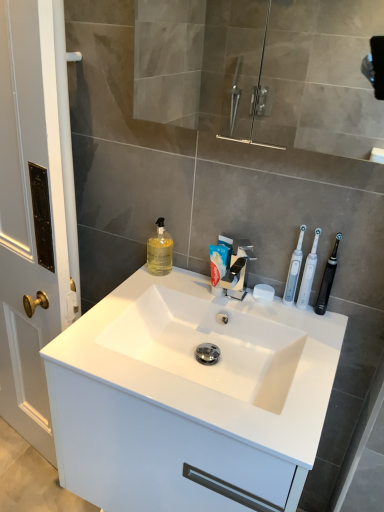
You are a GUI agent. You are given a task and a screenshot of the screen. Output one action in this format:
    pyautogui.click(x=<x>, y=<y>)
    Task: Click on the white matte soap at center
    This screenshot has width=384, height=512.
    Given the screenshot: What is the action you would take?
    pyautogui.click(x=263, y=293)

The height and width of the screenshot is (512, 384). Identify the location of white matte toothpaste at center. (219, 263).

How much space does white plastic toothbrushes at right, which is the 1th toothbrush in left-to-right order, occupy vertically?

white plastic toothbrushes at right, which is the 1th toothbrush in left-to-right order, is 9.53 inches tall.

What do you see at coordinates (327, 279) in the screenshot? I see `black plastic toothbrush at right, which is the first toothbrush in right-to-left order` at bounding box center [327, 279].

Locate an element on the screen. white matte soap at center is located at coordinates (263, 293).

Could you tell me if black plastic toothbrush at right, which is the third toothbrush from left to right, is turned towards white matte soap at center?

No, black plastic toothbrush at right, which is the third toothbrush from left to right, is not facing towards white matte soap at center.

From the picture: Can you confirm if black plastic toothbrush at right, which is the first toothbrush in right-to-left order, is shorter than white matte soap at center?

No, black plastic toothbrush at right, which is the first toothbrush in right-to-left order, is not shorter than white matte soap at center.

From the image's perspective, is black plastic toothbrush at right, which is the third toothbrush from left to right, located above white matte soap at center?

Yes, from the image's perspective, black plastic toothbrush at right, which is the third toothbrush from left to right, is over white matte soap at center.

Is point (322, 303) closer to viewer compared to point (264, 300)?

Yes, point (322, 303) is in front of point (264, 300).

Is black plastic toothbrush at right, which is the first toothbrush in right-to-left order, at the back of white matte soap at center?

That's not correct — white matte soap at center is not looking away from black plastic toothbrush at right, which is the first toothbrush in right-to-left order.

Image resolution: width=384 pixels, height=512 pixels. What are the coordinates of `the 3rd toothbrush counting from the right side of the white matte soap at center` in the screenshot? It's located at 327,279.

From their relative heights in the image, would you say white matte soap at center is taller or shorter than black plastic toothbrush at right, which is the first toothbrush in right-to-left order?

Considering their sizes, white matte soap at center has less height than black plastic toothbrush at right, which is the first toothbrush in right-to-left order.

Does white matte soap at center appear on the left side of black plastic toothbrush at right, which is the third toothbrush from left to right?

Indeed, white matte soap at center is positioned on the left side of black plastic toothbrush at right, which is the third toothbrush from left to right.

From a real-world perspective, is transparent glass mirror at upper center positioned over polished chrome faucet at center based on gravity?

Yes.

From the image's perspective, is transparent glass mirror at upper center positioned above or below polished chrome faucet at center?

From the image's perspective, transparent glass mirror at upper center appears above polished chrome faucet at center.

Locate an element on the screen. This screenshot has width=384, height=512. mirror located above the polished chrome faucet at center (from a real-world perspective) is located at coordinates (321, 77).

Which object is more forward, transparent glass mirror at upper center or polished chrome faucet at center?

transparent glass mirror at upper center.

From the image's perspective, relative to black plastic toothbrush at right, which is the first toothbrush in right-to-left order, is white matte toothpaste at center above or below?

Based on their image positions, white matte toothpaste at center is located above black plastic toothbrush at right, which is the first toothbrush in right-to-left order.

Considering their positions, is white matte toothpaste at center located in front of or behind black plastic toothbrush at right, which is the first toothbrush in right-to-left order?

In the image, white matte toothpaste at center appears behind black plastic toothbrush at right, which is the first toothbrush in right-to-left order.

Is black plastic toothbrush at right, which is the first toothbrush in right-to-left order, a part of white matte toothpaste at center?

That's incorrect, black plastic toothbrush at right, which is the first toothbrush in right-to-left order, is not inside white matte toothpaste at center.

Is point (332, 283) less distant than point (309, 260)?

No, (332, 283) is behind (309, 260).

Looking at this image, from the image's perspective, is black plastic toothbrush at right, which is the third toothbrush from left to right, on white plastic toothbrush at right, the second toothbrush positioned from the left?

No, from the image's perspective, black plastic toothbrush at right, which is the third toothbrush from left to right, is not over white plastic toothbrush at right, the second toothbrush positioned from the left.

From the picture: Does black plastic toothbrush at right, which is the third toothbrush from left to right, have a greater height compared to white plastic toothbrush at right, the second toothbrush positioned from the left?

Incorrect, the height of black plastic toothbrush at right, which is the third toothbrush from left to right, is not larger of that of white plastic toothbrush at right, the second toothbrush positioned from the left.

Which object is more forward, black plastic toothbrush at right, which is the first toothbrush in right-to-left order, or white glossy cabinet at center?

white glossy cabinet at center is in front.

Is black plastic toothbrush at right, which is the third toothbrush from left to right, next to white glossy cabinet at center and touching it?

No, black plastic toothbrush at right, which is the third toothbrush from left to right, is not beside white glossy cabinet at center.

Between black plastic toothbrush at right, which is the third toothbrush from left to right, and white glossy cabinet at center, which one appears on the left side from the viewer's perspective?

From the viewer's perspective, white glossy cabinet at center appears more on the left side.

Which of these two, black plastic toothbrush at right, which is the first toothbrush in right-to-left order, or white glossy cabinet at center, stands shorter?

With less height is white glossy cabinet at center.

From a real-world perspective, which is physically below, white matte soap at center or white plastic toothbrushes at right, which is the 1th toothbrush in left-to-right order?

white matte soap at center.

Are white matte soap at center and white plastic toothbrushes at right, which is the third toothbrush in right-to-left order, making contact?

Yes, white matte soap at center is next to white plastic toothbrushes at right, which is the third toothbrush in right-to-left order.

Considering their positions, is white matte soap at center located in front of or behind white plastic toothbrushes at right, which is the third toothbrush in right-to-left order?

Clearly, white matte soap at center is behind white plastic toothbrushes at right, which is the third toothbrush in right-to-left order.

Between point (262, 286) and point (305, 225), which one is positioned in front?

Positioned in front is point (305, 225).

Where is `soap below the black plastic toothbrush at right, which is the first toothbrush in right-to-left order (from a real-world perspective)`? Image resolution: width=384 pixels, height=512 pixels. soap below the black plastic toothbrush at right, which is the first toothbrush in right-to-left order (from a real-world perspective) is located at coordinates (263, 293).

Identify the location of toothbrush that is the 1st object located above the white matte soap at center (from the image's perspective). (327, 279).

Based on their spatial positions, is white matte soap at center or white plastic toothbrush at right, the second toothbrush positioned from the left, closer to white plastic toothbrushes at right, which is the third toothbrush in right-to-left order?

Among the two, white plastic toothbrush at right, the second toothbrush positioned from the left, is located nearer to white plastic toothbrushes at right, which is the third toothbrush in right-to-left order.

Looking at this image, looking at the image, which one is located further to transparent glass mirror at upper center, white glossy cabinet at center or translucent yellow liquid at sink left?

white glossy cabinet at center is further to transparent glass mirror at upper center.

From the image, which object appears to be nearer to white matte toothpaste at center, white matte soap at center or polished chrome faucet at center?

Among the two, polished chrome faucet at center is located nearer to white matte toothpaste at center.

In the scene shown: Considering their positions, is black plastic toothbrush at right, which is the third toothbrush from left to right, positioned further to white plastic toothbrush at right, the 2th toothbrush in the right-to-left sequence, than white matte toothpaste at center?

The object further to white plastic toothbrush at right, the 2th toothbrush in the right-to-left sequence, is white matte toothpaste at center.

Looking at the image, which one is located further to white plastic toothbrush at right, the second toothbrush positioned from the left, white matte toothpaste at center or white plastic toothbrushes at right, which is the third toothbrush in right-to-left order?

Among the two, white matte toothpaste at center is located further to white plastic toothbrush at right, the second toothbrush positioned from the left.

From the image, which object appears to be farther from white plastic toothbrush at right, the 2th toothbrush in the right-to-left sequence, transparent glass mirror at upper center or black plastic toothbrush at right, which is the third toothbrush from left to right?

transparent glass mirror at upper center is positioned further to the anchor white plastic toothbrush at right, the 2th toothbrush in the right-to-left sequence.

Considering their positions, is white plastic toothbrushes at right, which is the third toothbrush in right-to-left order, positioned further to black plastic toothbrush at right, which is the first toothbrush in right-to-left order, than white plastic toothbrush at right, the second toothbrush positioned from the left?

The object further to black plastic toothbrush at right, which is the first toothbrush in right-to-left order, is white plastic toothbrushes at right, which is the third toothbrush in right-to-left order.

Which object lies nearer to the anchor point black plastic toothbrush at right, which is the third toothbrush from left to right, white matte toothpaste at center or polished chrome faucet at center?

polished chrome faucet at center.

Locate an element on the screen. Image resolution: width=384 pixels, height=512 pixels. toothpaste between white glossy cabinet at center and white matte soap at center in the front-back direction is located at coordinates (219, 263).

Image resolution: width=384 pixels, height=512 pixels. I want to click on tap located between white glossy cabinet at center and white matte soap at center in the depth direction, so [238, 270].

Locate an element on the screen. tap between white glossy cabinet at center and white plastic toothbrushes at right, which is the 1th toothbrush in left-to-right order, in the front-back direction is located at coordinates pos(238,270).

The image size is (384, 512). I want to click on tap between white glossy cabinet at center and white matte toothpaste at center from front to back, so click(238, 270).